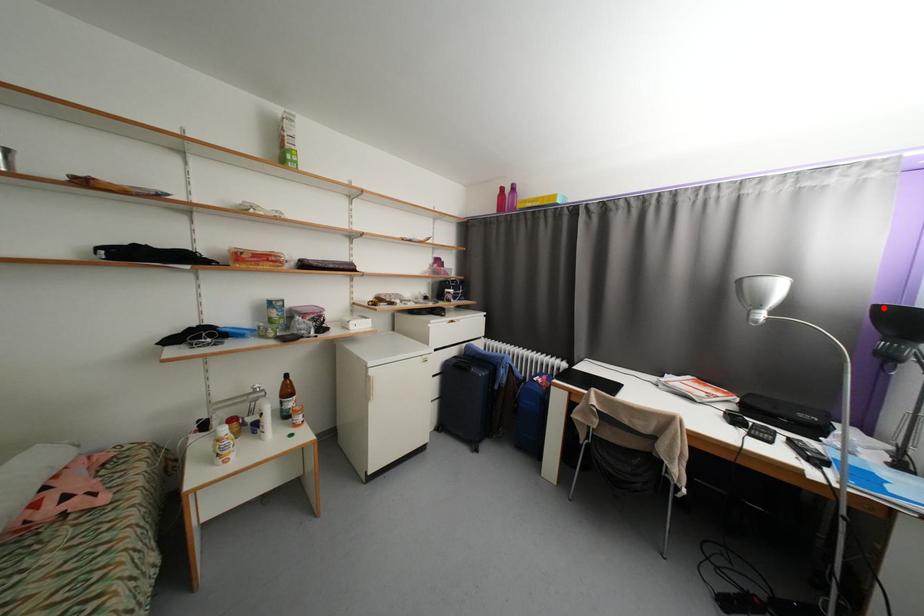
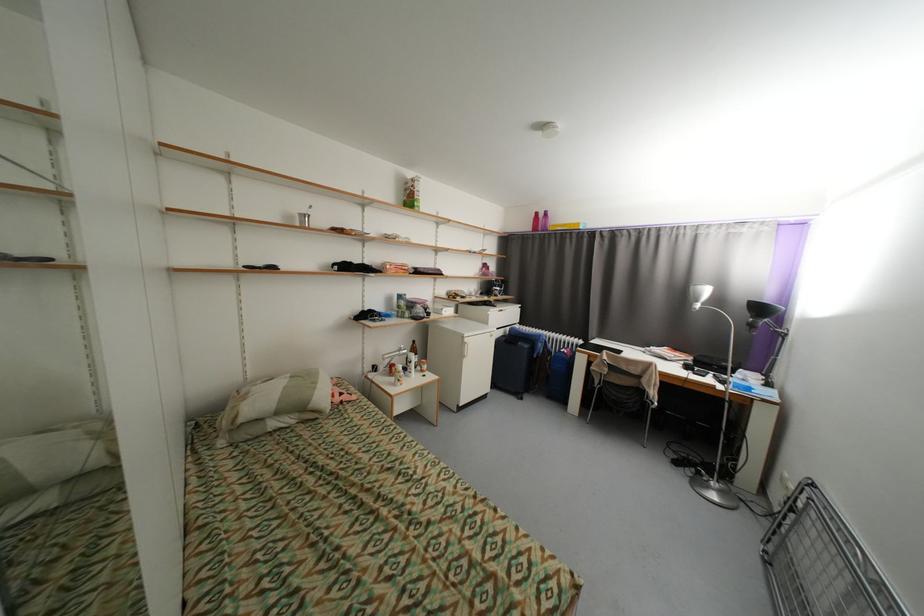
Where in the second image is the point corresponding to the highlighted location from the first image?

(756, 302)